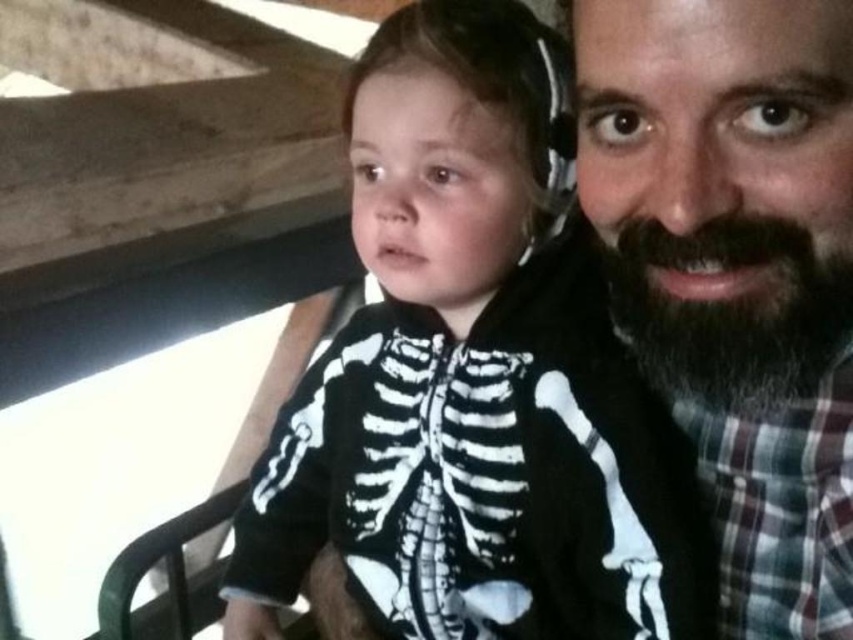
Question: Which object is positioned closest to the bearded man at right?

Choices:
 (A) dark brown fuzzy beard at upper right
 (B) black matte skeleton onesie at center

Answer: (A)

Question: Which object appears closest to the camera in this image?

Choices:
 (A) black matte skeleton onesie at center
 (B) dark brown fuzzy beard at upper right
 (C) bearded man at right

Answer: (C)

Question: Which of the following is the closest to the observer?

Choices:
 (A) bearded man at right
 (B) black matte skeleton onesie at center

Answer: (A)

Question: From the image, what is the correct spatial relationship of bearded man at right in relation to dark brown fuzzy beard at upper right?

Choices:
 (A) right
 (B) left

Answer: (A)

Question: Can you confirm if black matte skeleton onesie at center is bigger than bearded man at right?

Choices:
 (A) yes
 (B) no

Answer: (A)

Question: Can you confirm if black matte skeleton onesie at center is positioned to the right of bearded man at right?

Choices:
 (A) no
 (B) yes

Answer: (A)